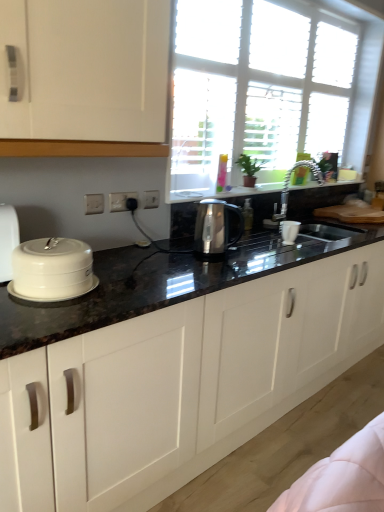
Identify the location of vacant region in front of satin metallic kettle at center. (215, 263).